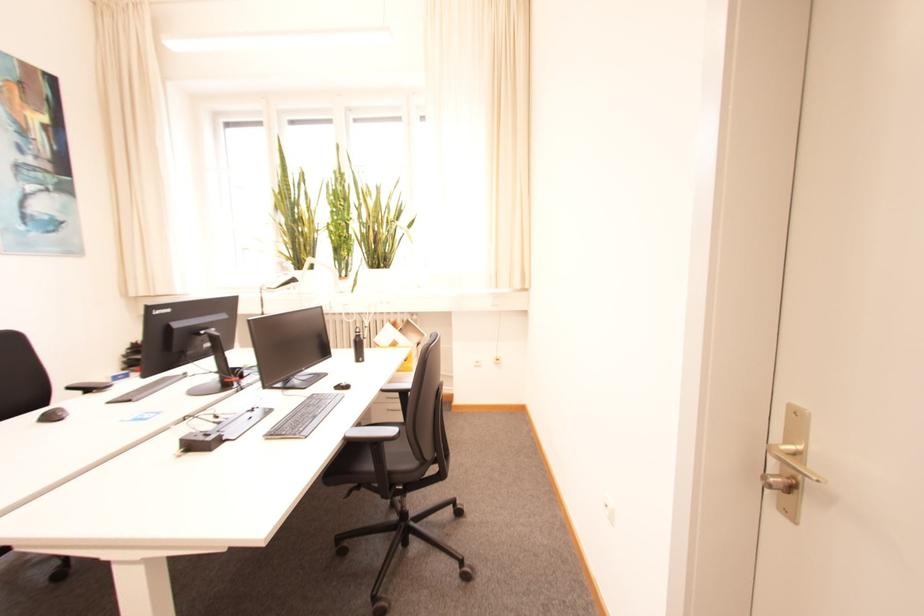
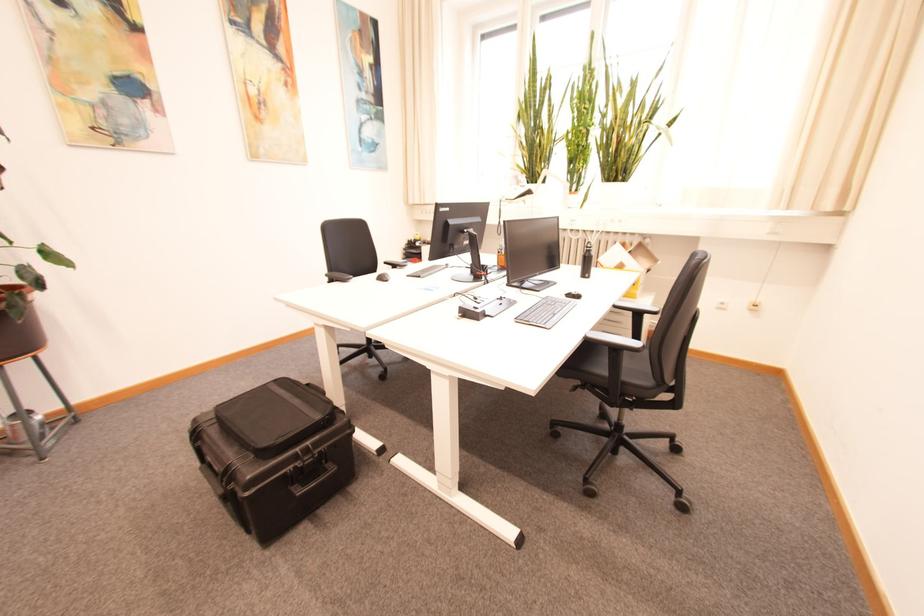
In the second image, find the point that corresponds to pixel 57 419 in the first image.

(388, 280)